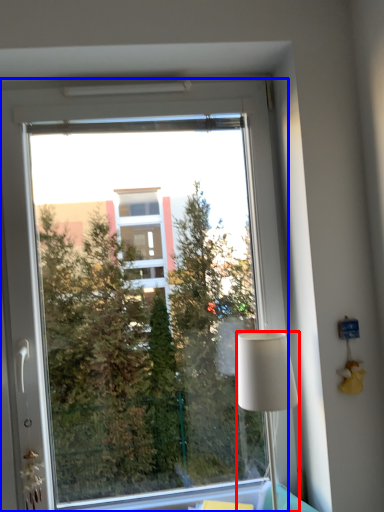
Question: Which object is closer to the camera taking this photo, lamp (highlighted by a red box) or window (highlighted by a blue box)?

Choices:
 (A) lamp
 (B) window

Answer: (A)